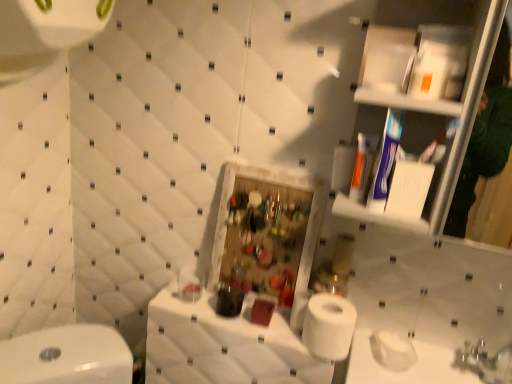
Question: In the image, is white fabric counter at center positioned in front of or behind white matte toilet paper at lower right?

Choices:
 (A) behind
 (B) front

Answer: (B)

Question: Is point (283, 344) closer or farther from the camera than point (375, 334)?

Choices:
 (A) closer
 (B) farther

Answer: (A)

Question: In terms of size, does white fabric counter at center appear bigger or smaller than white matte toilet paper at lower right?

Choices:
 (A) big
 (B) small

Answer: (A)

Question: Considering their positions, is white matte toilet paper at lower right located in front of or behind white fabric counter at center?

Choices:
 (A) behind
 (B) front

Answer: (A)

Question: Does point (397, 365) appear closer or farther from the camera than point (266, 357)?

Choices:
 (A) farther
 (B) closer

Answer: (A)

Question: Would you say white matte toilet paper at lower right is inside or outside white fabric counter at center?

Choices:
 (A) inside
 (B) outside

Answer: (B)

Question: Considering the positions of white matte toilet paper at lower right and white fabric counter at center in the image, is white matte toilet paper at lower right wider or thinner than white fabric counter at center?

Choices:
 (A) thin
 (B) wide

Answer: (A)